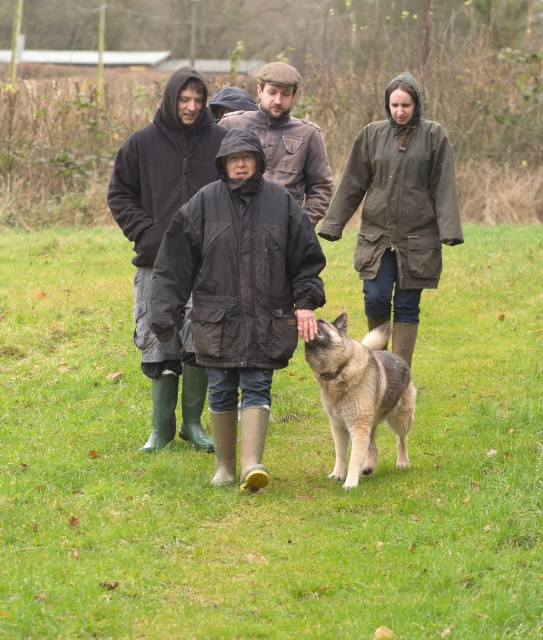
Question: Which object is the closest to the dark matte jacket at center?

Choices:
 (A) black matte jacket at center
 (B) green grassy at center

Answer: (A)

Question: Does black matte jacket at center have a smaller size compared to dark matte jacket at center?

Choices:
 (A) yes
 (B) no

Answer: (A)

Question: In this image, where is green grassy at center located relative to black matte jacket at center?

Choices:
 (A) above
 (B) below

Answer: (B)

Question: Which object is positioned farthest from the brown leather jacket at center?

Choices:
 (A) dark matte jacket at center
 (B) green grassy at center
 (C) black matte jacket at center

Answer: (B)

Question: Can you confirm if green grassy at center is positioned above brown leather jacket at center?

Choices:
 (A) no
 (B) yes

Answer: (A)

Question: Which point is closer to the camera taking this photo?

Choices:
 (A) (325, 166)
 (B) (302, 532)

Answer: (B)